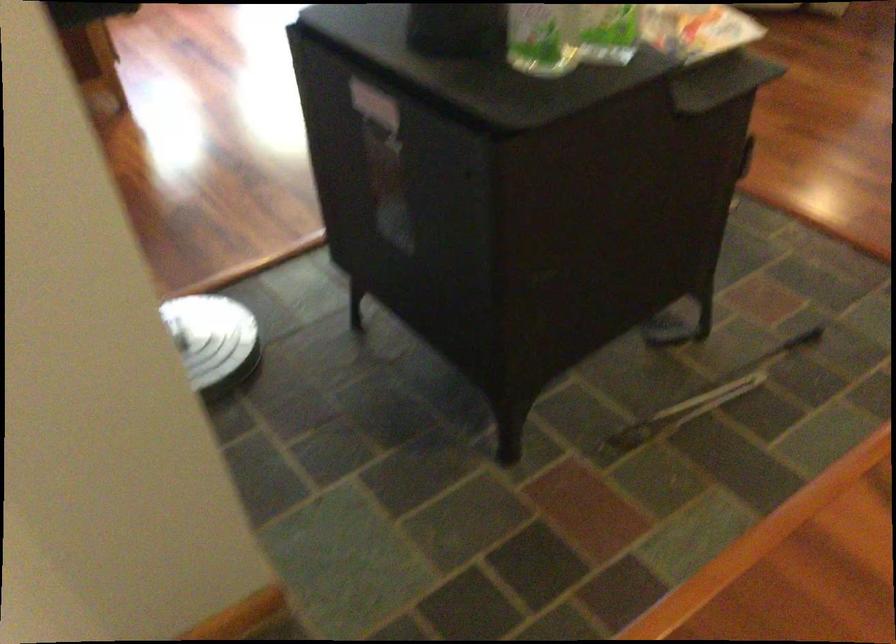
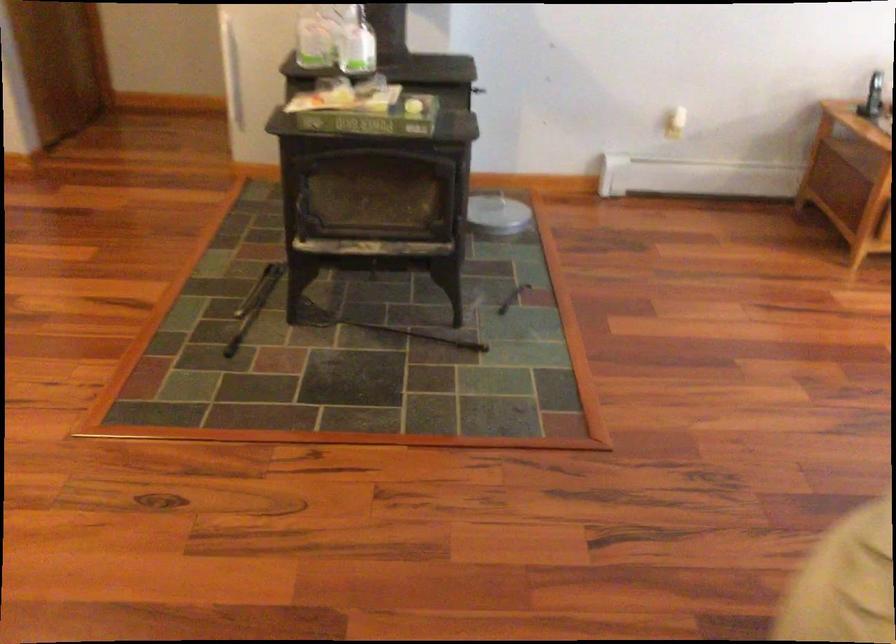
The point at [714,388] is marked in the first image. Where is the corresponding point in the second image?

(254, 305)